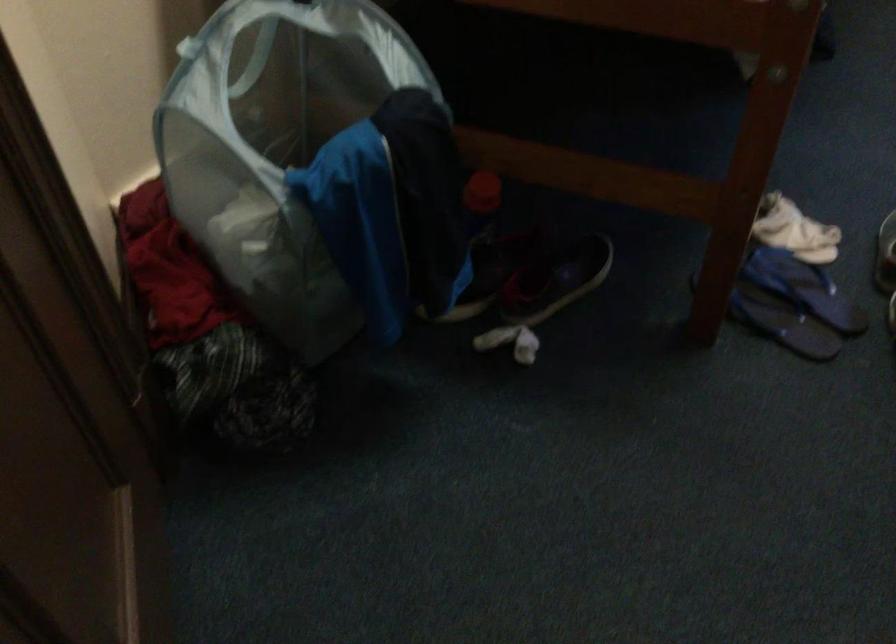
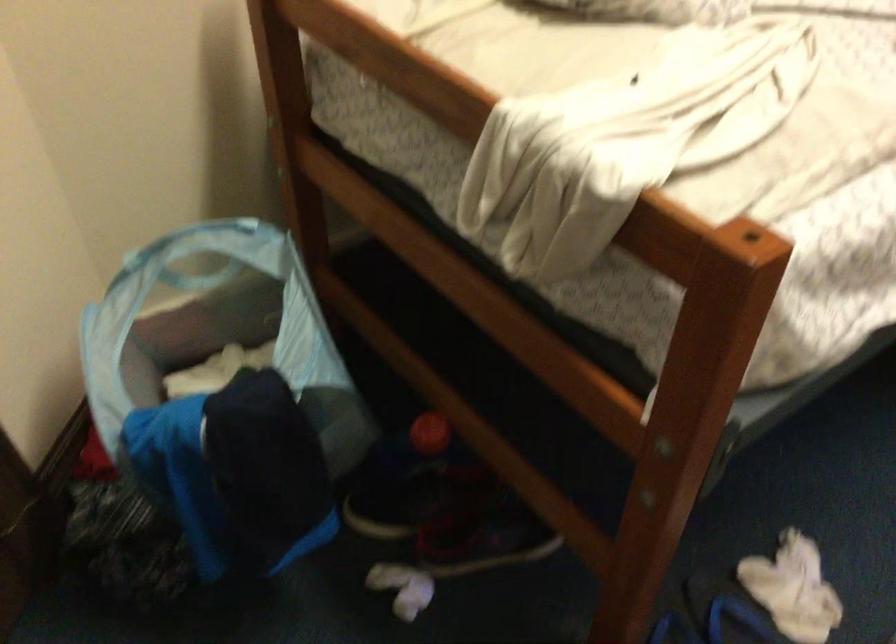
Question: The images are taken continuously from a first-person perspective. In which direction are you moving?

Choices:
 (A) Left
 (B) Right
 (C) Forward
 (D) Backward

Answer: (B)